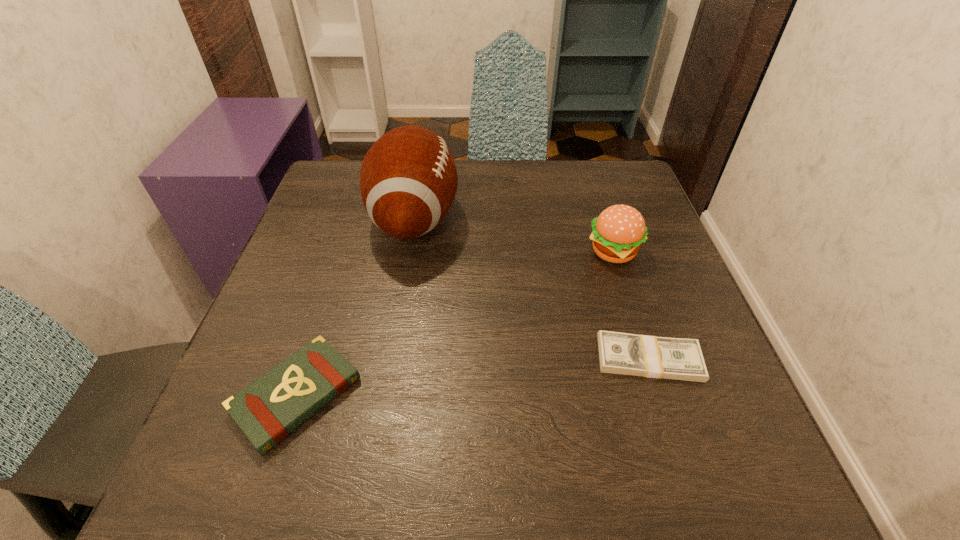
You are a GUI agent. You are given a task and a screenshot of the screen. Output one action in this format:
    pyautogui.click(x=<x>, y=<y>)
    Task: Click on the empty location between the third shortest object and the dollar
    The width and height of the screenshot is (960, 540).
    Given the screenshot: What is the action you would take?
    pyautogui.click(x=632, y=305)

Locate an element on the screen. This screenshot has width=960, height=540. object that is the closest one to the dollar is located at coordinates (617, 233).

Select which object is the third closest to the hamburger. Please provide its 2D coordinates. Your answer should be formatted as a tuple, i.e. [(x, y)], where the tuple contains the x and y coordinates of a point satisfying the conditions above.

[(267, 410)]

Where is `vacant space that satisfies the following two spatial constraints: 1. on the laces of the football; 2. on the right side of the hamburger`? vacant space that satisfies the following two spatial constraints: 1. on the laces of the football; 2. on the right side of the hamburger is located at coordinates (409, 252).

You are a GUI agent. You are given a task and a screenshot of the screen. Output one action in this format:
    pyautogui.click(x=<x>, y=<y>)
    Task: Click on the vacant space that satisfies the following two spatial constraints: 1. on the laces of the tallest object; 2. on the left side of the shortest object
    The width and height of the screenshot is (960, 540).
    Given the screenshot: What is the action you would take?
    pyautogui.click(x=391, y=359)

The height and width of the screenshot is (540, 960). In order to click on vacant space that satisfies the following two spatial constraints: 1. on the laces of the tallest object; 2. on the front side of the book in this screenshot , I will do `click(384, 395)`.

This screenshot has height=540, width=960. Identify the location of vacant space that satisfies the following two spatial constraints: 1. on the laces of the football; 2. on the front side of the book. (384, 395).

Identify the location of free location that satisfies the following two spatial constraints: 1. on the laces of the tallest object; 2. on the back side of the dollar. [391, 359].

Find the location of a particular element. vacant space that satisfies the following two spatial constraints: 1. on the back side of the hamburger; 2. on the left side of the second shortest object is located at coordinates (344, 252).

Image resolution: width=960 pixels, height=540 pixels. What are the coordinates of `free space that satisfies the following two spatial constraints: 1. on the back side of the third shortest object; 2. on the right side of the second shortest object` in the screenshot? It's located at (344, 252).